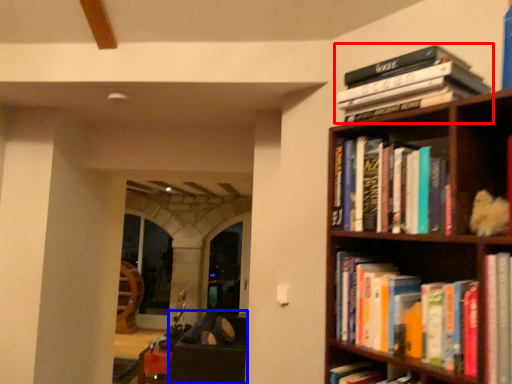
Question: Which object appears farthest to the camera in this image, book (highlighted by a red box) or furniture (highlighted by a blue box)?

Choices:
 (A) book
 (B) furniture

Answer: (B)